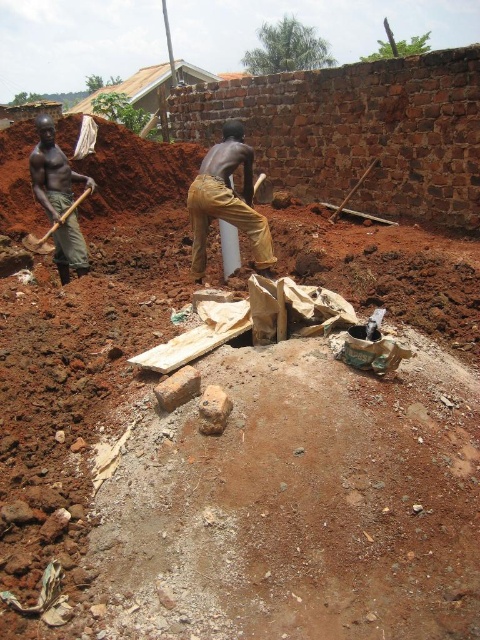
Is brown cotton pants at center further to camera compared to dark skin shovel at left?

No.

Between point (256, 248) and point (48, 152), which one is positioned behind?

The point (48, 152) is more distant.

Is point (200, 218) closer to viewer compared to point (60, 248)?

Yes, point (200, 218) is in front of point (60, 248).

The height and width of the screenshot is (640, 480). Identify the location of brown cotton pants at center. (227, 200).

Between brown cotton pants at center and wooden handle shovel at left, which one is positioned lower?

Positioned lower is wooden handle shovel at left.

Does brown cotton pants at center appear over wooden handle shovel at left?

Correct, brown cotton pants at center is located above wooden handle shovel at left.

Where is `brown cotton pants at center`? brown cotton pants at center is located at coordinates (227, 200).

Where is `brown cotton pants at center`? brown cotton pants at center is located at coordinates (227, 200).

This screenshot has height=640, width=480. Describe the element at coordinates (59, 198) in the screenshot. I see `dark skin shovel at left` at that location.

I want to click on dark skin shovel at left, so click(x=59, y=198).